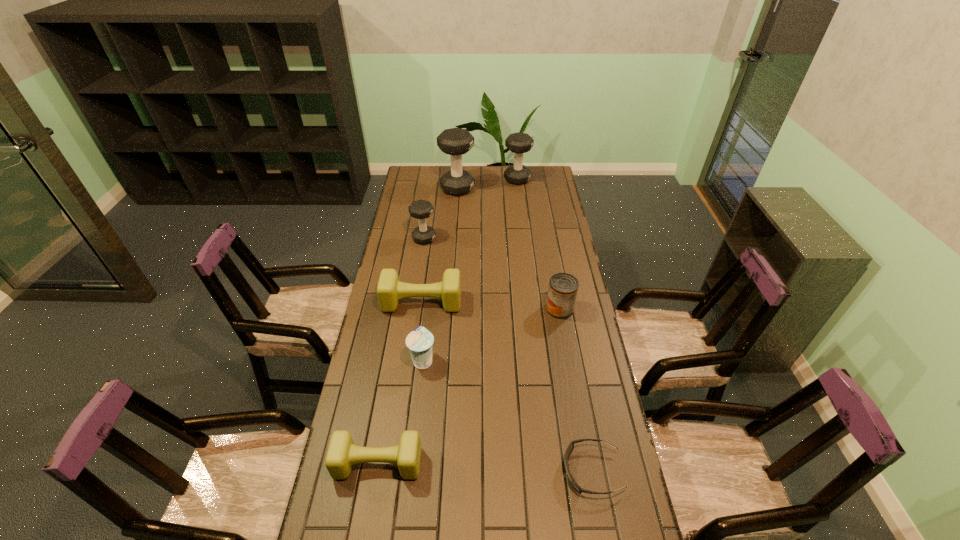
The width and height of the screenshot is (960, 540). Identify the location of object that is the fourth closest to the yogurt. (570, 447).

Point out which object is positioned as the seventh nearest to the third farthest dumbbell. Please provide its 2D coordinates. Your answer should be formatted as a tuple, i.e. [(x, y)], where the tuple contains the x and y coordinates of a point satisfying the conditions above.

[(570, 447)]

I want to click on dumbbell that is the second closest to the smaller olive dumbbell, so click(x=421, y=209).

Identify which dumbbell is the nearest to the second shortest dumbbell. Please provide its 2D coordinates. Your answer should be formatted as a tuple, i.e. [(x, y)], where the tuple contains the x and y coordinates of a point satisfying the conditions above.

[(421, 209)]

Identify which gray dumbbell is the second nearest to the red can. Please provide its 2D coordinates. Your answer should be formatted as a tuple, i.e. [(x, y)], where the tuple contains the x and y coordinates of a point satisfying the conditions above.

[(455, 141)]

At what (x,y) coordinates should I click in order to perform the action: click on gray dumbbell that is the closest to the biggest gray dumbbell. Please return your answer as a coordinate pair (x, y). Looking at the image, I should click on (518, 143).

Find the location of a particular element. The image size is (960, 540). the second closest olive dumbbell to the red can is located at coordinates click(342, 453).

Identify which olive dumbbell is the nearest to the can. Please provide its 2D coordinates. Your answer should be formatted as a tuple, i.e. [(x, y)], where the tuple contains the x and y coordinates of a point satisfying the conditions above.

[(390, 290)]

At what (x,y) coordinates should I click in order to perform the action: click on free location that satisfies the following two spatial constraints: 1. on the back side of the nearer olive dumbbell; 2. on the right side of the can. Please return your answer as a coordinate pair (x, y). Looking at the image, I should click on (404, 309).